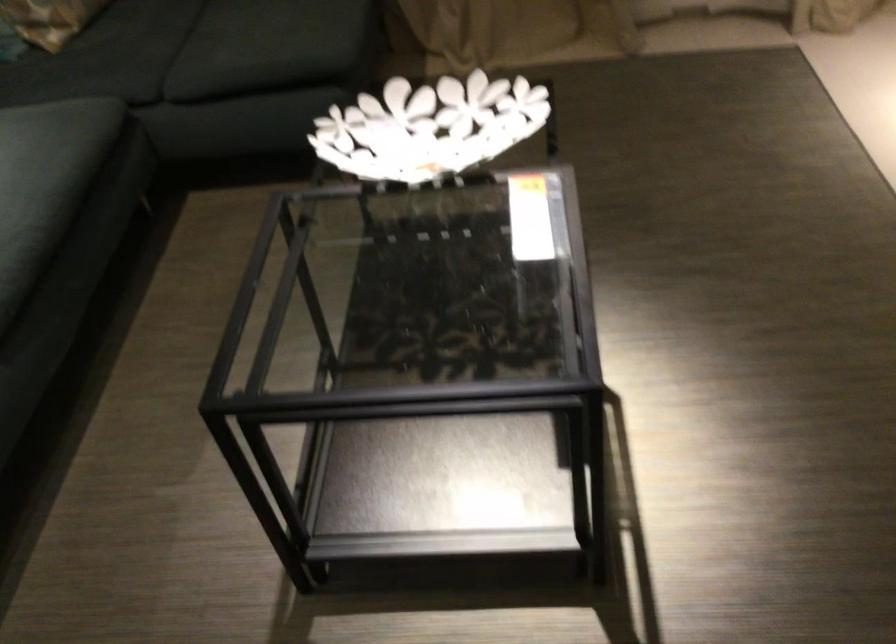
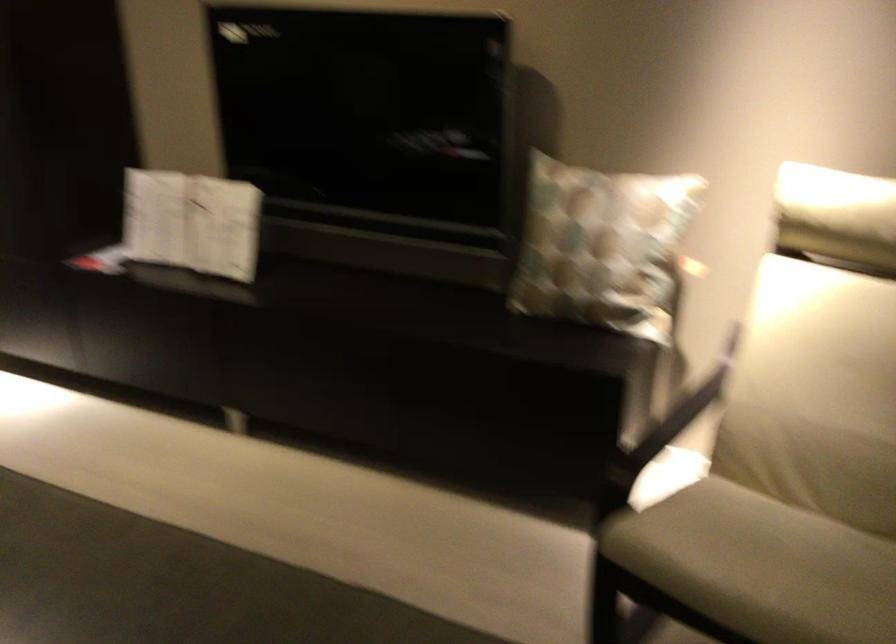
Question: The camera is either moving clockwise (left) or counter-clockwise (right) around the object. The first image is from the beginning of the video and the second image is from the end. Is the camera moving left or right when shooting the video?

Choices:
 (A) Left
 (B) Right

Answer: (A)